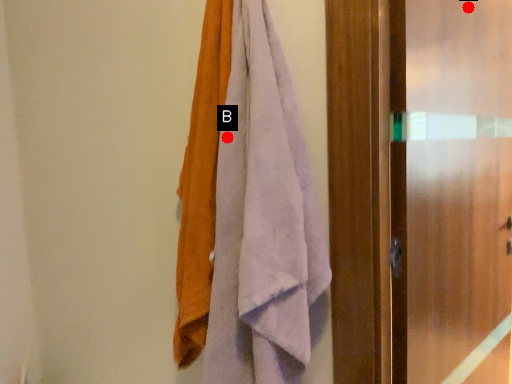
Question: Two points are circled on the image, labeled by A and B beside each circle. Which point is closer to the camera?

Choices:
 (A) A is closer
 (B) B is closer

Answer: (B)